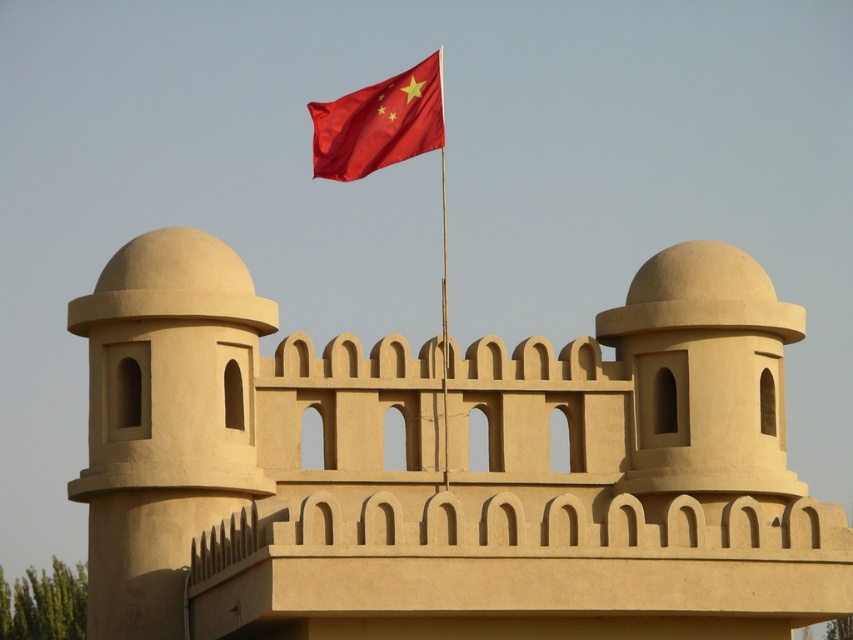
Which is above, matte beige tower at left or smooth red flag at upper center?

smooth red flag at upper center is higher up.

Can you confirm if matte beige tower at left is shorter than smooth red flag at upper center?

No.

Which is behind, point (149, 458) or point (334, 163)?

Point (334, 163)

Find the location of a particular element. matte beige tower at left is located at coordinates (164, 420).

Does beige stone fort at center appear over smooth red flag at upper center?

Incorrect, beige stone fort at center is not positioned above smooth red flag at upper center.

Is beige stone fort at center wider than smooth red flag at upper center?

Yes, beige stone fort at center is wider than smooth red flag at upper center.

Does point (253, 374) come behind point (397, 131)?

That is False.

In order to click on beige stone fort at center in this screenshot , I will do `click(440, 472)`.

Does beige stone fort at center have a greater width compared to matte beige tower at left?

Yes.

Is the position of beige stone fort at center less distant than that of matte beige tower at left?

Yes.

Locate an element on the screen. The image size is (853, 640). beige stone fort at center is located at coordinates tap(440, 472).